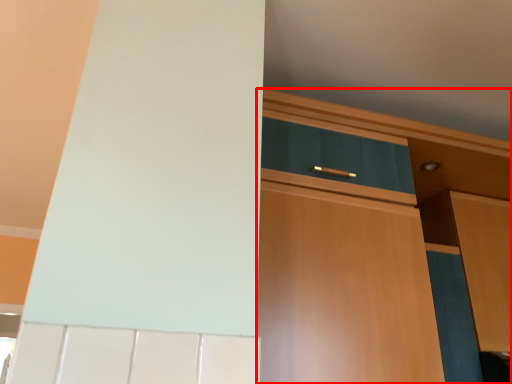
Question: Observing the image, what is the correct spatial positioning of cabinetry (annotated by the red box) in reference to cabinetry?

Choices:
 (A) left
 (B) right

Answer: (A)